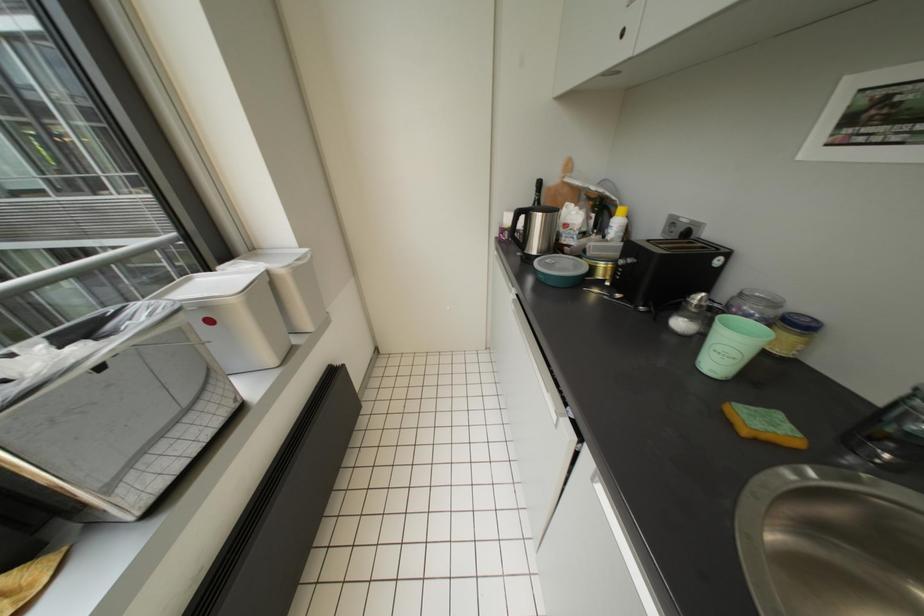
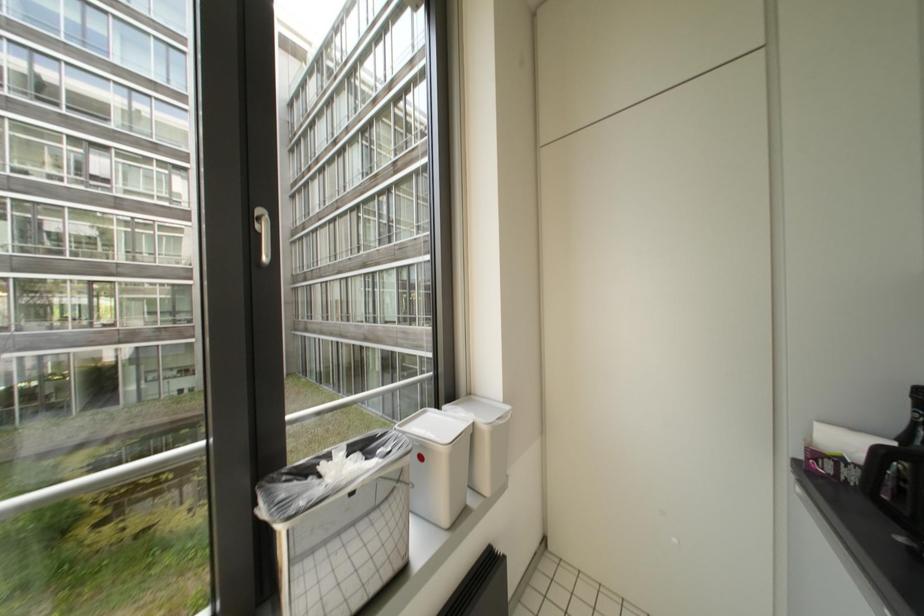
First-person continuous shooting, in which direction is the camera rotating?

The camera's rotation is toward left-up.